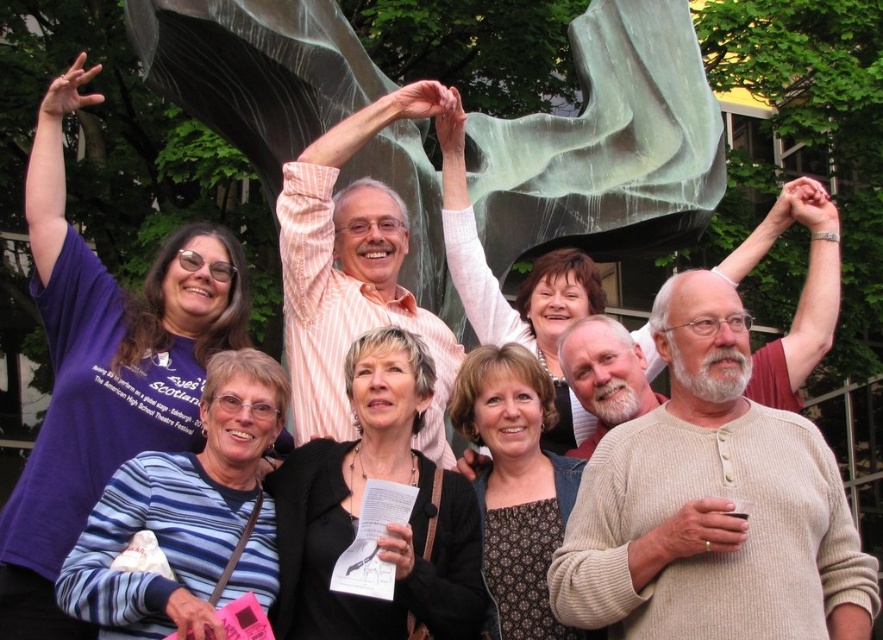
You are standing at the location where the photo was taken. There is a purple cotton shirt at upper left in the image. Can you reach out and touch it without moving from your current position?

The purple cotton shirt at upper left is 32.41 meters away from the viewer, so you cannot reach it without moving.

You are standing in front of the sculpture and want to locate the black matte jacket at center. According to the coordinates provided, where exactly would you find it?

The black matte jacket at center is located at point coordinates 0.823 on the x axis and 0.439 on the y axis.